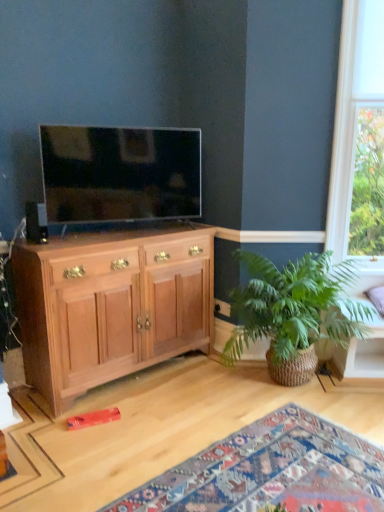
Question: Is point (291, 435) positioned closer to the camera than point (109, 245)?

Choices:
 (A) closer
 (B) farther

Answer: (A)

Question: Is wooden toy at lower left taller or shorter than wooden cabinet at left?

Choices:
 (A) tall
 (B) short

Answer: (B)

Question: Considering the real-world distances, which object is closest to the green woven basket at right?

Choices:
 (A) matte black tv at upper left
 (B) wooden cabinet at left
 (C) matte black speaker at left
 (D) wooden cabinet at center
 (E) wooden toy at lower left

Answer: (D)

Question: Which is farther from the wooden toy at lower left?

Choices:
 (A) green woven basket at right
 (B) wooden cabinet at center
 (C) matte black speaker at left
 (D) matte black tv at upper left
 (E) wooden cabinet at left

Answer: (C)